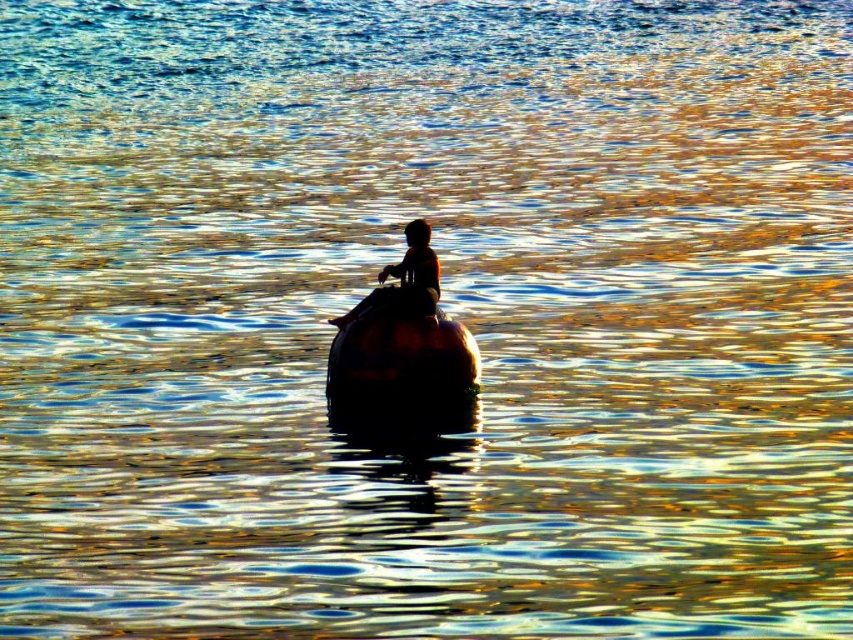
You are standing on the shore of the lake and see the shiny brown boat at center and the silhouette human at center. Which object is positioned to the left when viewed from your perspective?

The shiny brown boat at center is to the left of the silhouette human at center from your perspective on the shore.

You are a photographer trying to capture the silhouette human at center and the shiny brown boat at center in a single frame. Based on their positions, which object is closer to the camera?

The silhouette human at center is closer to the camera because the shiny brown boat at center is positioned below it, indicating that the human is in front.

Consider the image. You are a photographer trying to capture the silhouette human at center and shiny brown boat at center in a single shot. Based on their sizes, which one will appear larger in the photo?

The shiny brown boat at center will appear much larger in the photo since it is much taller than the silhouette human at center.